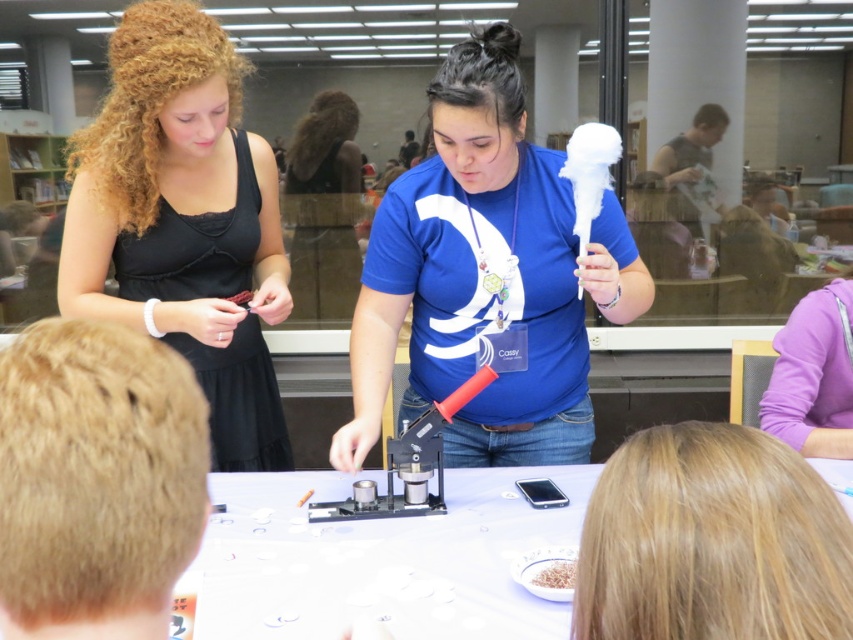
Does point (248, 241) come in front of point (554, 577)?

No, it is behind (554, 577).

Does black satin dress at upper left have a greater width compared to brown crumbly food at center?

Yes, black satin dress at upper left is wider than brown crumbly food at center.

Find the location of `black satin dress at upper left`. black satin dress at upper left is located at coordinates (183, 221).

Between blonde hair at lower right and brown crumbly food at center, which one has less height?

brown crumbly food at center

Which is behind, point (703, 436) or point (566, 572)?

The point (566, 572) is more distant.

Does point (836, 506) come behind point (544, 584)?

That is False.

You are a GUI agent. You are given a task and a screenshot of the screen. Output one action in this format:
    pyautogui.click(x=<x>, y=<y>)
    Task: Click on the blonde hair at lower right
    This screenshot has width=853, height=640.
    Given the screenshot: What is the action you would take?
    pyautogui.click(x=711, y=541)

Is white paper at center wider than brown crumbly food at center?

Correct, the width of white paper at center exceeds that of brown crumbly food at center.

Who is shorter, white paper at center or brown crumbly food at center?

brown crumbly food at center

The width and height of the screenshot is (853, 640). Describe the element at coordinates (381, 560) in the screenshot. I see `white paper at center` at that location.

Locate an element on the screen. white paper at center is located at coordinates (381, 560).